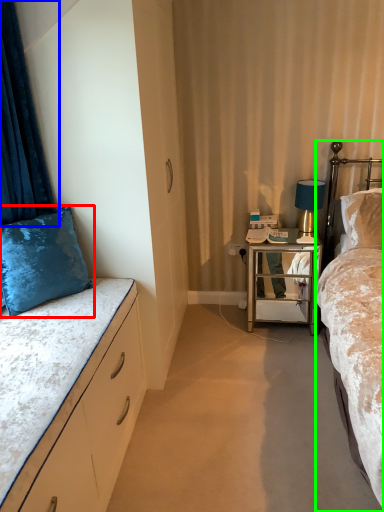
Question: Which is farther away from pillow (highlighted by a red box)? curtain (highlighted by a blue box) or bed (highlighted by a green box)?

Choices:
 (A) curtain
 (B) bed

Answer: (B)